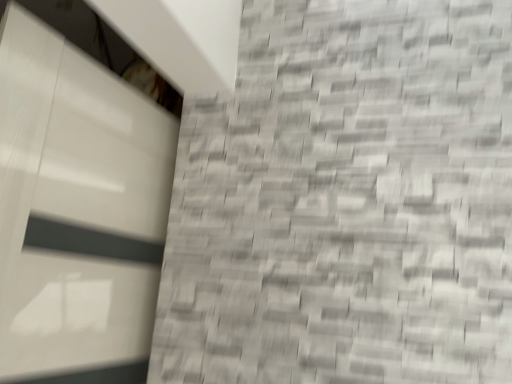
The image size is (512, 384). What do you see at coordinates (77, 211) in the screenshot?
I see `white glossy door at upper left` at bounding box center [77, 211].

What is the approximate height of white glossy door at upper left?

29.59 inches.

The width and height of the screenshot is (512, 384). I want to click on white glossy door at upper left, so click(x=77, y=211).

Measure the distance between point (153, 132) and camera.

Point (153, 132) and camera are 1.14 meters apart from each other.

This screenshot has width=512, height=384. Find the location of `white glossy door at upper left`. white glossy door at upper left is located at coordinates (77, 211).